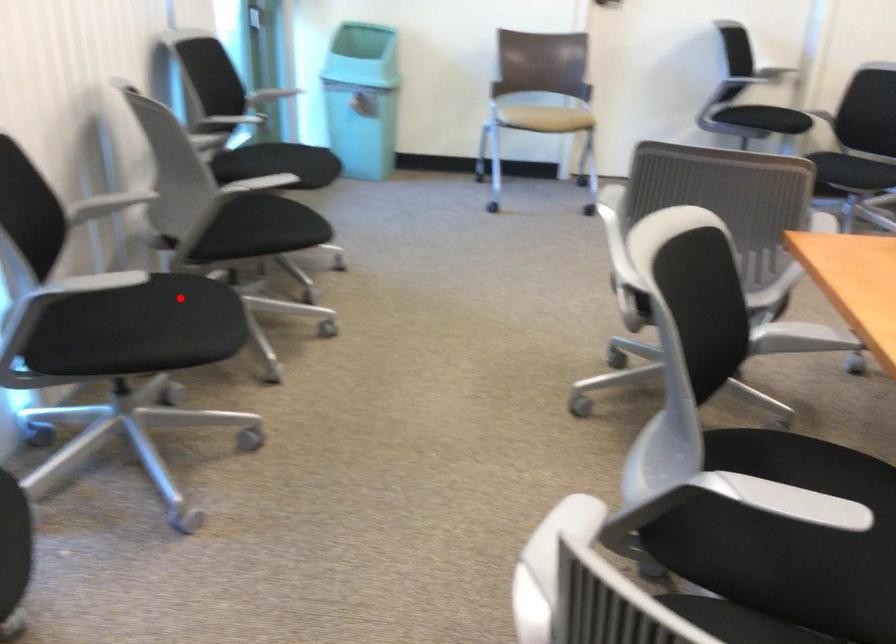
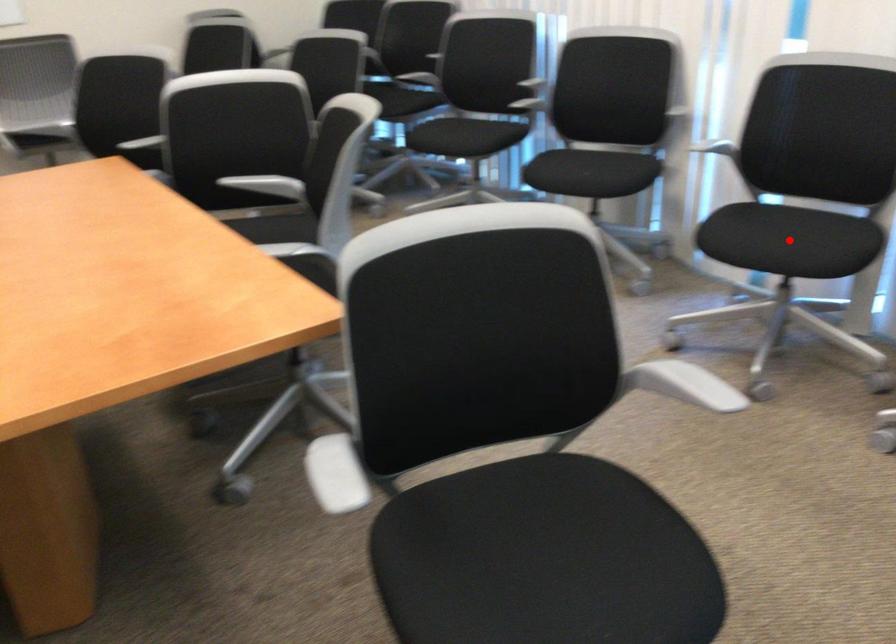
I am providing you with two images of the same scene from different viewpoints. A red point is marked on the first image and another point is marked on the second image. Is the red point in image1 aligned with the point shown in image2?

Yes